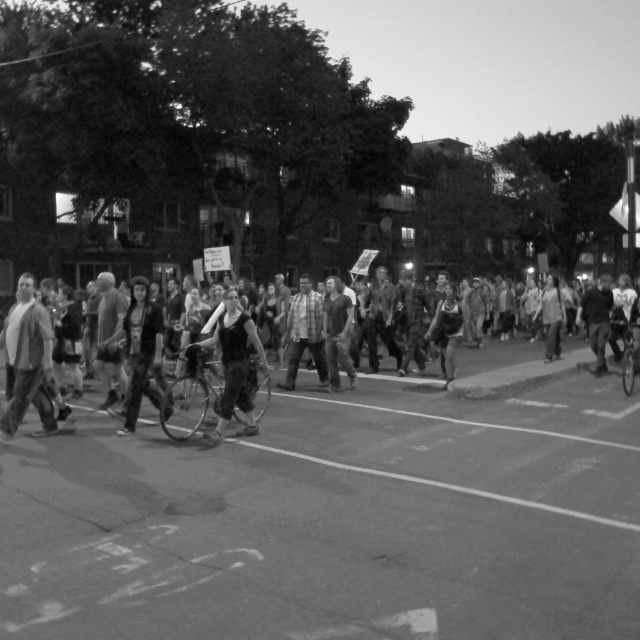
Who is positioned more to the left, matte gray shirt at left or dark fabric shirt at center?

matte gray shirt at left

Is matte gray shirt at left further to camera compared to dark fabric shirt at center?

No, matte gray shirt at left is in front of dark fabric shirt at center.

Locate an element on the screen. matte gray shirt at left is located at coordinates (26, 358).

Which is below, matte gray shirt at left or black fabric dress at center?

black fabric dress at center

Who is more distant from viewer, (28, 340) or (244, 362)?

Positioned behind is point (244, 362).

This screenshot has height=640, width=640. I want to click on matte gray shirt at left, so click(26, 358).

The height and width of the screenshot is (640, 640). I want to click on matte gray shirt at left, so click(x=26, y=358).

Looking at this image, does black fabric dress at center have a greater height compared to dark fabric shirt at center?

No.

Can you confirm if black fabric dress at center is bigger than dark fabric shirt at center?

Actually, black fabric dress at center might be smaller than dark fabric shirt at center.

Describe the element at coordinates (232, 364) in the screenshot. This screenshot has height=640, width=640. I see `black fabric dress at center` at that location.

This screenshot has width=640, height=640. In order to click on black fabric dress at center in this screenshot , I will do `click(232, 364)`.